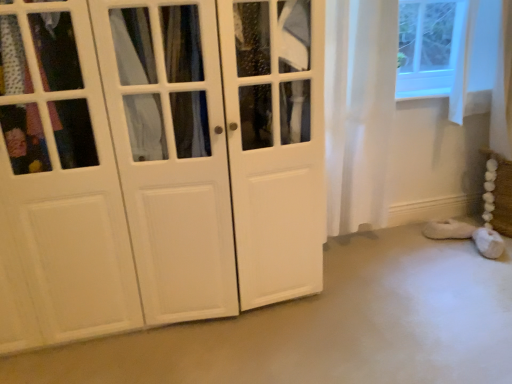
Question: Is white fluffy slipper at lower right positioned before white sheer curtain at right?

Choices:
 (A) yes
 (B) no

Answer: (B)

Question: From a real-world perspective, is white fluffy slipper at lower right over white sheer curtain at right?

Choices:
 (A) yes
 (B) no

Answer: (B)

Question: Is there a large distance between white fluffy slipper at lower right and white sheer curtain at right?

Choices:
 (A) no
 (B) yes

Answer: (A)

Question: Can you confirm if white fluffy slipper at lower right is bigger than white sheer curtain at right?

Choices:
 (A) no
 (B) yes

Answer: (A)

Question: Does white fluffy slipper at lower right appear on the right side of white sheer curtain at right?

Choices:
 (A) no
 (B) yes

Answer: (B)

Question: Is white fluffy slipper at lower right bigger or smaller than white matte cabinet at left?

Choices:
 (A) big
 (B) small

Answer: (B)

Question: Is white fluffy slipper at lower right in front of or behind white matte cabinet at left in the image?

Choices:
 (A) front
 (B) behind

Answer: (B)

Question: Considering the positions of point (457, 225) and point (91, 61), is point (457, 225) closer or farther from the camera than point (91, 61)?

Choices:
 (A) farther
 (B) closer

Answer: (A)

Question: From a real-world perspective, is white fluffy slipper at lower right physically located above or below white matte cabinet at left?

Choices:
 (A) above
 (B) below

Answer: (B)

Question: From a real-world perspective, is white matte cabinet at left physically located above or below white fluffy slipper at lower right?

Choices:
 (A) below
 (B) above

Answer: (B)

Question: Is white matte cabinet at left taller or shorter than white fluffy slipper at lower right?

Choices:
 (A) short
 (B) tall

Answer: (B)

Question: In terms of size, does white matte cabinet at left appear bigger or smaller than white fluffy slipper at lower right?

Choices:
 (A) big
 (B) small

Answer: (A)

Question: Considering the positions of point (193, 264) and point (445, 218), is point (193, 264) closer or farther from the camera than point (445, 218)?

Choices:
 (A) farther
 (B) closer

Answer: (B)

Question: In terms of size, does white sheer curtain at right appear bigger or smaller than white fluffy slipper at lower right?

Choices:
 (A) small
 (B) big

Answer: (B)

Question: From a real-world perspective, is white sheer curtain at right physically located above or below white fluffy slipper at lower right?

Choices:
 (A) above
 (B) below

Answer: (A)